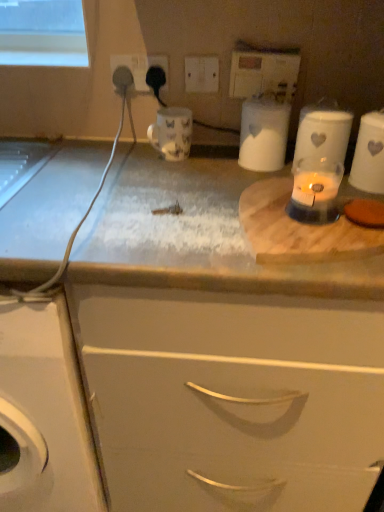
Question: Can you confirm if white matte cabinet at center is bigger than white plastic switch at upper center, which is the second electric outlet from right to left?

Choices:
 (A) no
 (B) yes

Answer: (B)

Question: Does white matte cabinet at center have a greater width compared to white plastic switch at upper center, which is the second electric outlet from right to left?

Choices:
 (A) no
 (B) yes

Answer: (B)

Question: From a real-world perspective, is white matte cabinet at center below white plastic switch at upper center, which is the 3th electric outlet in left-to-right order?

Choices:
 (A) yes
 (B) no

Answer: (A)

Question: Considering the relative sizes of white matte cabinet at center and white plastic switch at upper center, which is the second electric outlet from right to left, in the image provided, is white matte cabinet at center thinner than white plastic switch at upper center, which is the second electric outlet from right to left,?

Choices:
 (A) yes
 (B) no

Answer: (B)

Question: Considering the relative positions of white matte cabinet at center and white plastic switch at upper center, which is the second electric outlet from right to left, in the image provided, is white matte cabinet at center to the left of white plastic switch at upper center, which is the second electric outlet from right to left, from the viewer's perspective?

Choices:
 (A) no
 (B) yes

Answer: (A)

Question: In terms of width, does matte ceramic mug at center, which is counted as the first appliance, starting from the left, look wider or thinner when compared to white matte cabinet at center?

Choices:
 (A) wide
 (B) thin

Answer: (B)

Question: From a real-world perspective, is matte ceramic mug at center, which ranks as the 3th appliance in right-to-left order, above or below white matte cabinet at center?

Choices:
 (A) below
 (B) above

Answer: (B)

Question: Would you say matte ceramic mug at center, which ranks as the 3th appliance in right-to-left order, is to the left or to the right of white matte cabinet at center in the picture?

Choices:
 (A) right
 (B) left

Answer: (B)

Question: Choose the correct answer: Is matte ceramic mug at center, which is counted as the first appliance, starting from the left, inside white matte cabinet at center or outside it?

Choices:
 (A) outside
 (B) inside

Answer: (A)

Question: Considering the positions of point click(231, 71) and point click(135, 54), is point click(231, 71) closer or farther from the camera than point click(135, 54)?

Choices:
 (A) farther
 (B) closer

Answer: (B)

Question: Considering the positions of white plastic electric outlet at upper center, marked as the 1th electric outlet in a right-to-left arrangement, and black plastic socket at upper center, acting as the first electric outlet starting from the left, in the image, is white plastic electric outlet at upper center, marked as the 1th electric outlet in a right-to-left arrangement, wider or thinner than black plastic socket at upper center, acting as the first electric outlet starting from the left,?

Choices:
 (A) thin
 (B) wide

Answer: (B)

Question: Looking at the image, does white plastic electric outlet at upper center, which is the fourth electric outlet in left-to-right order, seem bigger or smaller compared to black plastic socket at upper center, acting as the first electric outlet starting from the left?

Choices:
 (A) small
 (B) big

Answer: (B)

Question: In terms of height, does white plastic electric outlet at upper center, marked as the 1th electric outlet in a right-to-left arrangement, look taller or shorter compared to black plastic socket at upper center, the fourth electric outlet positioned from the right?

Choices:
 (A) tall
 (B) short

Answer: (A)

Question: Is white matte container at upper center, the second appliance in the right-to-left sequence, in front of or behind translucent glass candle at center in the image?

Choices:
 (A) front
 (B) behind

Answer: (B)

Question: Is white matte container at upper center, the second appliance in the right-to-left sequence, bigger or smaller than translucent glass candle at center?

Choices:
 (A) small
 (B) big

Answer: (B)